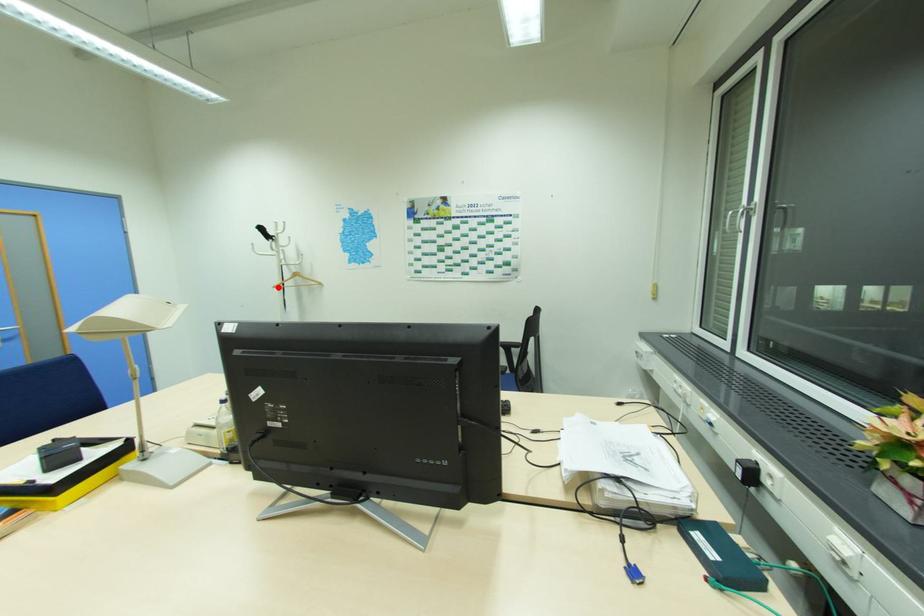
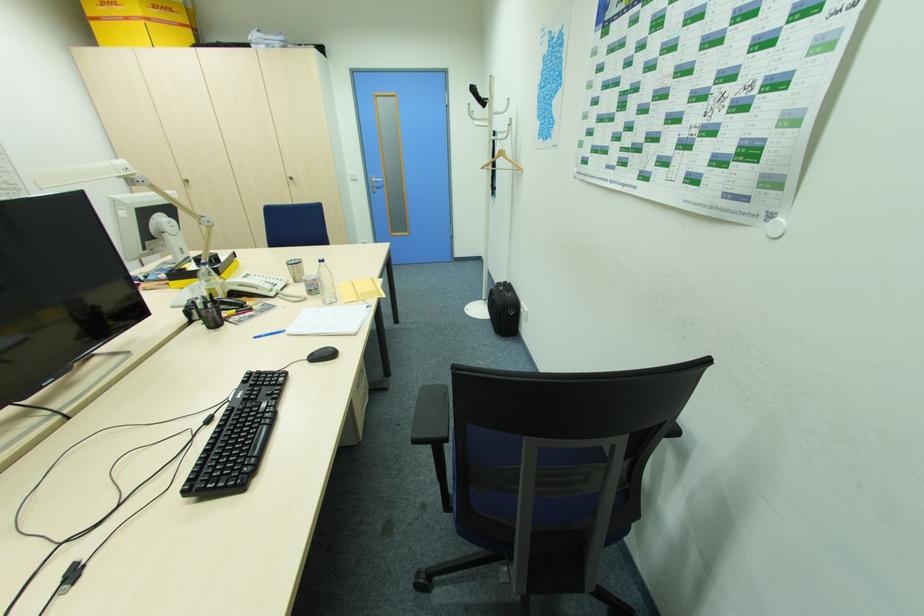
In the second image, find the point that corresponds to the highlighted location in the first image.

(485, 168)